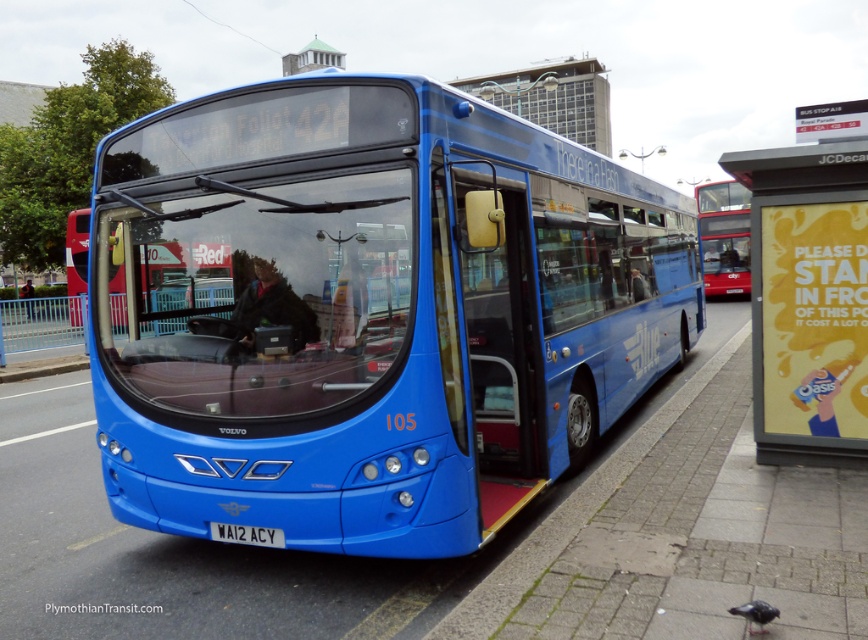
You are a pedestrian standing at the bus stop and want to board the blue metallic bus at center. However, there is a person wearing a dark blue jacket at center blocking the entrance. Can you walk around them to get to the bus door?

The blue metallic bus at center is shorter than the dark blue jacket at center, so the person wearing the dark blue jacket at center is taller than the bus. Since the bus door is open, you can easily walk around the person wearing the dark blue jacket at center to reach the bus door.

You are a pedestrian waiting at the bus stop. You want to check the license plate of the blue metallic bus at center before it departs. Can you see the white matte license plate at center from your current position?

The white matte license plate at center is behind the blue metallic bus at center, so you cannot see it from your current position at the bus stop.

You are a delivery person who needs to place a package on top of the blue metallic bus at center. Can you confirm if the yellow paper poster at right is taller than the bus?

The blue metallic bus at center has a lesser height compared to the yellow paper poster at right, so yes, the yellow paper poster at right is taller than the bus.